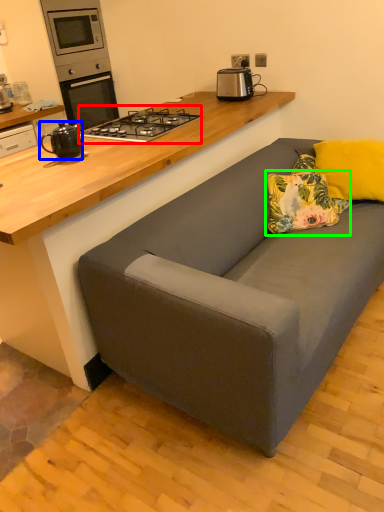
Question: Which is farther away from gas stove (highlighted by a red box)? kitchen appliance (highlighted by a blue box) or pillow (highlighted by a green box)?

Choices:
 (A) kitchen appliance
 (B) pillow

Answer: (B)